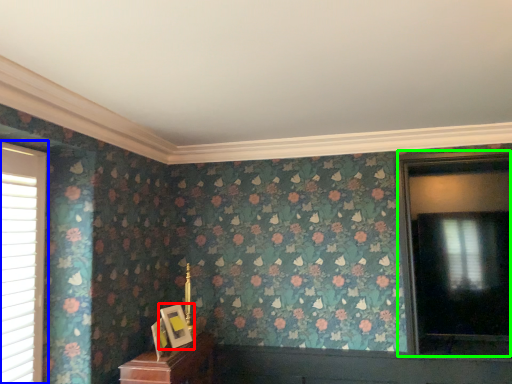
Question: Based on their relative distances, which object is farther from picture frame (highlighted by a red box)? Choose from window (highlighted by a blue box) and window (highlighted by a green box).

Choices:
 (A) window
 (B) window

Answer: (B)